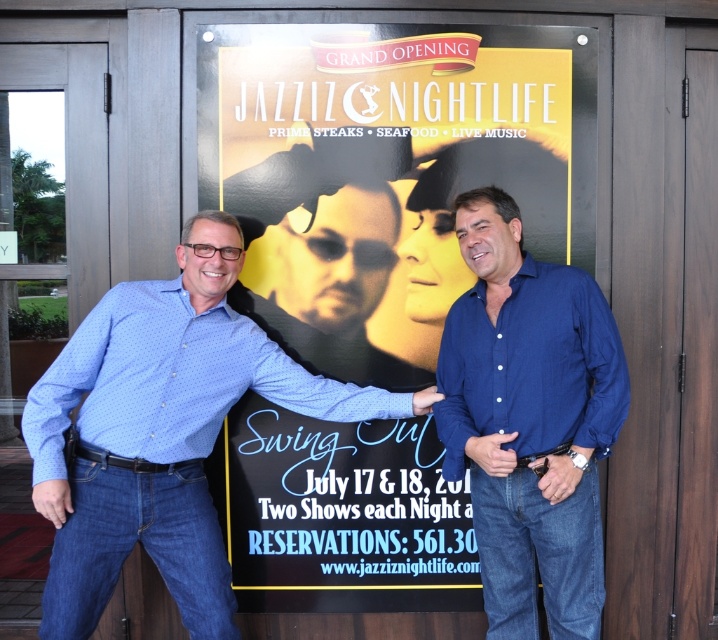
Is point (321, 337) positioned in front of point (111, 396)?

No, it is not.

Can you confirm if yellow paper poster at center is smaller than blue dotted shirt at left?

Yes.

Is point (325, 570) positioned before point (98, 609)?

No.

The image size is (718, 640). I want to click on yellow paper poster at center, so click(386, 173).

Does blue dotted shirt at left appear over blue cotton shirt at right?

Incorrect, blue dotted shirt at left is not positioned above blue cotton shirt at right.

Who is taller, blue dotted shirt at left or blue cotton shirt at right?

With more height is blue cotton shirt at right.

Measure the distance between blue dotted shirt at left and camera.

The distance of blue dotted shirt at left from camera is 8.39 feet.

The image size is (718, 640). Find the location of `blue dotted shirt at left`. blue dotted shirt at left is located at coordinates (162, 433).

Based on the photo, who is more distant from viewer, [470,51] or [510,232]?

The point [470,51] is behind.

Does yellow paper poster at center appear on the left side of blue cotton shirt at right?

Yes, yellow paper poster at center is to the left of blue cotton shirt at right.

The image size is (718, 640). In order to click on yellow paper poster at center in this screenshot , I will do pyautogui.click(x=386, y=173).